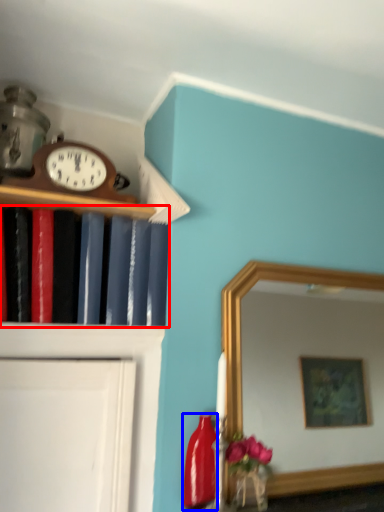
Question: Which of the following is the closest to the observer, book (highlighted by a red box) or bottle (highlighted by a blue box)?

Choices:
 (A) book
 (B) bottle

Answer: (A)